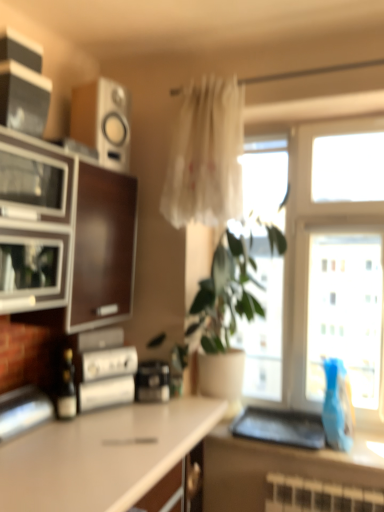
Find the location of a particular element. Image resolution: width=384 pixels, height=512 pixels. matte black speaker at upper left, which ranks as the third appliance in bottom-to-top order is located at coordinates (23, 98).

Find the location of a particular element. The width and height of the screenshot is (384, 512). wooden/matte speaker at upper left, the 4th appliance positioned from the bottom is located at coordinates (103, 121).

Measure the distance between smooth brown countertop at lower right, acting as the 2th countertop starting from the left, and camera.

The depth of smooth brown countertop at lower right, acting as the 2th countertop starting from the left, is 1.77 meters.

Identify the location of brown glossy cabinet at left. (78, 222).

Measure the distance between point (x=28, y=504) and camera.

They are 1.19 meters apart.

Find the location of a particular element. white matte countertop at lower left, arranged as the second countertop when viewed from the top is located at coordinates (102, 456).

What do you see at coordinates (334, 261) in the screenshot? I see `transparent glass window at center` at bounding box center [334, 261].

What is the approximate height of blue glass vase at right?

blue glass vase at right is 15.35 inches in height.

Where is `matte black speaker at upper left, arranged as the 2th appliance when viewed from the top`? The image size is (384, 512). matte black speaker at upper left, arranged as the 2th appliance when viewed from the top is located at coordinates (23, 98).

Which is behind, point (85, 102) or point (162, 362)?

The point (162, 362) is behind.

From the picture: From the image's perspective, is wooden/matte speaker at upper left, the 4th appliance positioned from the bottom, beneath black plastic toaster at center, which is the 3th appliance from top to bottom?

No.

Is wooden/matte speaker at upper left, the 4th appliance positioned from the bottom, thinner than black plastic toaster at center, the second appliance from the bottom?

Incorrect, the width of wooden/matte speaker at upper left, the 4th appliance positioned from the bottom, is not less than that of black plastic toaster at center, the second appliance from the bottom.

How many degrees apart are the facing directions of wooden/matte speaker at upper left, which ranks as the first appliance in top-to-bottom order, and black plastic toaster at center, which is the 3th appliance from top to bottom?

The facing directions of wooden/matte speaker at upper left, which ranks as the first appliance in top-to-bottom order, and black plastic toaster at center, which is the 3th appliance from top to bottom, are 40.9 degrees apart.

Which object is positioned more to the left, transparent glass window at center or matte glass bottle at center?

Positioned to the left is matte glass bottle at center.

Who is taller, transparent glass window at center or matte glass bottle at center?

transparent glass window at center is taller.

Considering the positions of point (297, 233) and point (64, 376), is point (297, 233) closer or farther from the camera than point (64, 376)?

Clearly, point (297, 233) is more distant from the camera than point (64, 376).

Does transparent glass window at center have a greater width compared to matte glass bottle at center?

Correct, the width of transparent glass window at center exceeds that of matte glass bottle at center.

Consider the image. Is translucent fabric curtain at center far away from smooth brown countertop at lower right, placed as the 1th countertop when sorted from top to bottom?

Absolutely, translucent fabric curtain at center is distant from smooth brown countertop at lower right, placed as the 1th countertop when sorted from top to bottom.

The width and height of the screenshot is (384, 512). Identify the location of curtain on the left of smooth brown countertop at lower right, which is the first countertop from right to left. (206, 156).

Is translucent fabric curtain at center inside the boundaries of smooth brown countertop at lower right, which is the first countertop from right to left, or outside?

translucent fabric curtain at center cannot be found inside smooth brown countertop at lower right, which is the first countertop from right to left.

Looking at the image, does translucent fabric curtain at center seem bigger or smaller compared to smooth brown countertop at lower right, which ranks as the second countertop in bottom-to-top order?

In the image, translucent fabric curtain at center appears to be larger than smooth brown countertop at lower right, which ranks as the second countertop in bottom-to-top order.

Are transparent glass window at center and blue glass vase at right beside each other?

No, transparent glass window at center is not in contact with blue glass vase at right.

In terms of size, does transparent glass window at center appear bigger or smaller than blue glass vase at right?

Considering their sizes, transparent glass window at center takes up more space than blue glass vase at right.

From their relative heights in the image, would you say transparent glass window at center is taller or shorter than blue glass vase at right?

transparent glass window at center is taller than blue glass vase at right.

Which object is further away from the camera taking this photo, transparent glass window at center or white matte countertop at lower left, arranged as the 1th countertop when ordered from the bottom?

transparent glass window at center is further away from the camera.

What's the angular difference between transparent glass window at center and white matte countertop at lower left, arranged as the 1th countertop when ordered from the bottom,'s facing directions?

88.8 degrees separate the facing orientations of transparent glass window at center and white matte countertop at lower left, arranged as the 1th countertop when ordered from the bottom.

Would you say transparent glass window at center is outside white matte countertop at lower left, marked as the first countertop in a left-to-right arrangement?

Absolutely, transparent glass window at center is external to white matte countertop at lower left, marked as the first countertop in a left-to-right arrangement.

Which is more distant, (307, 343) or (164, 410)?

The point (307, 343) is farther from the camera.

From the image's perspective, would you say matte black speaker at upper left, which ranks as the third appliance in bottom-to-top order, is shown under transparent glass window at center?

No, from the image's perspective, matte black speaker at upper left, which ranks as the third appliance in bottom-to-top order, is not below transparent glass window at center.

Considering the relative sizes of matte black speaker at upper left, which ranks as the third appliance in bottom-to-top order, and transparent glass window at center in the image provided, is matte black speaker at upper left, which ranks as the third appliance in bottom-to-top order, bigger than transparent glass window at center?

Actually, matte black speaker at upper left, which ranks as the third appliance in bottom-to-top order, might be smaller than transparent glass window at center.

Considering the sizes of objects matte black speaker at upper left, which ranks as the third appliance in bottom-to-top order, and transparent glass window at center in the image provided, who is wider, matte black speaker at upper left, which ranks as the third appliance in bottom-to-top order, or transparent glass window at center?

Wider between the two is matte black speaker at upper left, which ranks as the third appliance in bottom-to-top order.

The width and height of the screenshot is (384, 512). What are the coordinates of `the 3rd appliance in front of the transparent glass window at center` in the screenshot? It's located at (23, 98).

Are wooden/matte speaker at upper left, which ranks as the first appliance in top-to-bottom order, and brown glossy cabinet at left far apart?

They are positioned close to each other.

From a real-world perspective, is wooden/matte speaker at upper left, which ranks as the first appliance in top-to-bottom order, on top of brown glossy cabinet at left?

Yes, from a real-world perspective, wooden/matte speaker at upper left, which ranks as the first appliance in top-to-bottom order, is above brown glossy cabinet at left.

Considering the positions of objects wooden/matte speaker at upper left, the 4th appliance positioned from the bottom, and brown glossy cabinet at left in the image provided, who is more to the left, wooden/matte speaker at upper left, the 4th appliance positioned from the bottom, or brown glossy cabinet at left?

Positioned to the left is brown glossy cabinet at left.

Find the location of `the 2nd appliance positioned below the wooden/matte speaker at upper left, which ranks as the first appliance in top-to-bottom order (from the image's perspective)`. the 2nd appliance positioned below the wooden/matte speaker at upper left, which ranks as the first appliance in top-to-bottom order (from the image's perspective) is located at coordinates (152, 381).

Identify the location of window behind the matte glass bottle at center. The width and height of the screenshot is (384, 512). (334, 261).

Looking at the image, which one is located closer to translucent fabric curtain at center, wooden/matte speaker at upper left, which ranks as the first appliance in top-to-bottom order, or blue glass vase at right?

wooden/matte speaker at upper left, which ranks as the first appliance in top-to-bottom order, lies closer to translucent fabric curtain at center than the other object.

Considering their positions, is white matte countertop at lower left, arranged as the 1th countertop when ordered from the bottom, positioned closer to black plastic toaster at center, the second appliance from the bottom, than transparent glass window at center?

white matte countertop at lower left, arranged as the 1th countertop when ordered from the bottom, is positioned closer to the anchor black plastic toaster at center, the second appliance from the bottom.

Estimate the real-world distances between objects in this image. Which object is further from blue glass vase at right, matte black speaker at upper left, arranged as the 2th appliance when viewed from the top, or wooden/matte speaker at upper left, the 4th appliance positioned from the bottom?

matte black speaker at upper left, arranged as the 2th appliance when viewed from the top, is positioned further to the anchor blue glass vase at right.

From the image, which object appears to be farther from blue glass vase at right, metallic silver toaster at left, positioned as the 1th appliance in bottom-to-top order, or translucent fabric curtain at center?

Among the two, metallic silver toaster at left, positioned as the 1th appliance in bottom-to-top order, is located further to blue glass vase at right.

Looking at the image, which one is located further to wooden/matte speaker at upper left, the 4th appliance positioned from the bottom, matte glass bottle at center or black plastic toaster at center, which is the 3th appliance from top to bottom?

The object further to wooden/matte speaker at upper left, the 4th appliance positioned from the bottom, is black plastic toaster at center, which is the 3th appliance from top to bottom.

When comparing their distances from translucent fabric curtain at center, does metallic silver toaster at left, positioned as the 1th appliance in bottom-to-top order, or wooden/matte speaker at upper left, which ranks as the first appliance in top-to-bottom order, seem closer?

The object closer to translucent fabric curtain at center is wooden/matte speaker at upper left, which ranks as the first appliance in top-to-bottom order.

Based on the photo, considering their positions, is matte black speaker at upper left, arranged as the 2th appliance when viewed from the top, positioned further to transparent glass window at center than matte glass bottle at center?

matte black speaker at upper left, arranged as the 2th appliance when viewed from the top.

Looking at the image, which one is located further to white matte countertop at lower left, marked as the first countertop in a left-to-right arrangement, matte black speaker at upper left, which ranks as the third appliance in bottom-to-top order, or metallic silver toaster at left, which is the fourth appliance in top-to-bottom order?

The object further to white matte countertop at lower left, marked as the first countertop in a left-to-right arrangement, is matte black speaker at upper left, which ranks as the third appliance in bottom-to-top order.

Where is `window between wooden/matte speaker at upper left, the 4th appliance positioned from the bottom, and blue glass vase at right in the up-down direction`? The width and height of the screenshot is (384, 512). window between wooden/matte speaker at upper left, the 4th appliance positioned from the bottom, and blue glass vase at right in the up-down direction is located at coordinates (334, 261).

Where is `bottle between matte black speaker at upper left, arranged as the 2th appliance when viewed from the top, and transparent glass window at center, in the horizontal direction`? This screenshot has width=384, height=512. bottle between matte black speaker at upper left, arranged as the 2th appliance when viewed from the top, and transparent glass window at center, in the horizontal direction is located at coordinates (66, 388).

The image size is (384, 512). Identify the location of curtain that lies between matte black speaker at upper left, which ranks as the third appliance in bottom-to-top order, and smooth brown countertop at lower right, acting as the 2th countertop starting from the left, from top to bottom. (206, 156).

Find the location of a particular element. cabinetry that lies between matte black speaker at upper left, which ranks as the third appliance in bottom-to-top order, and white matte countertop at lower left, arranged as the second countertop when viewed from the top, from top to bottom is located at coordinates (78, 222).